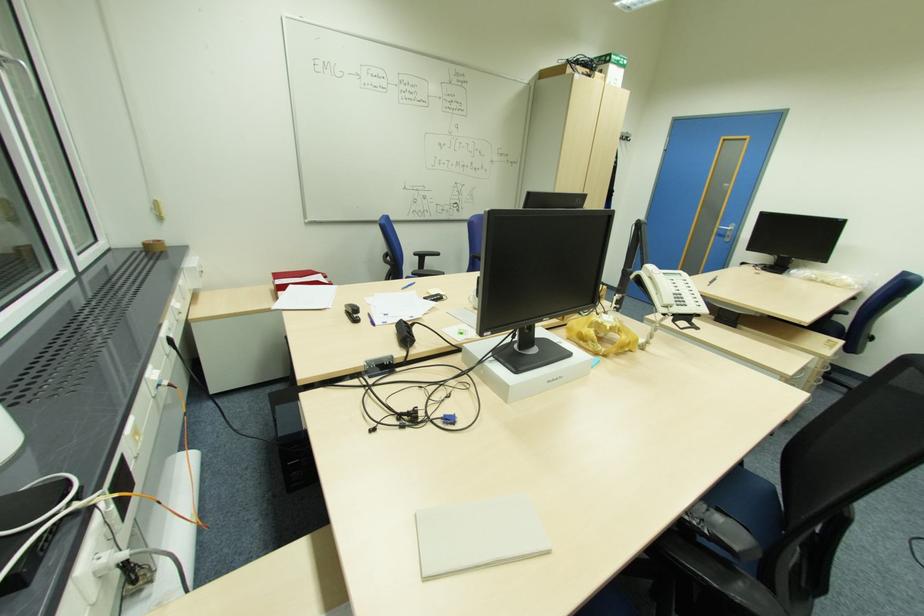
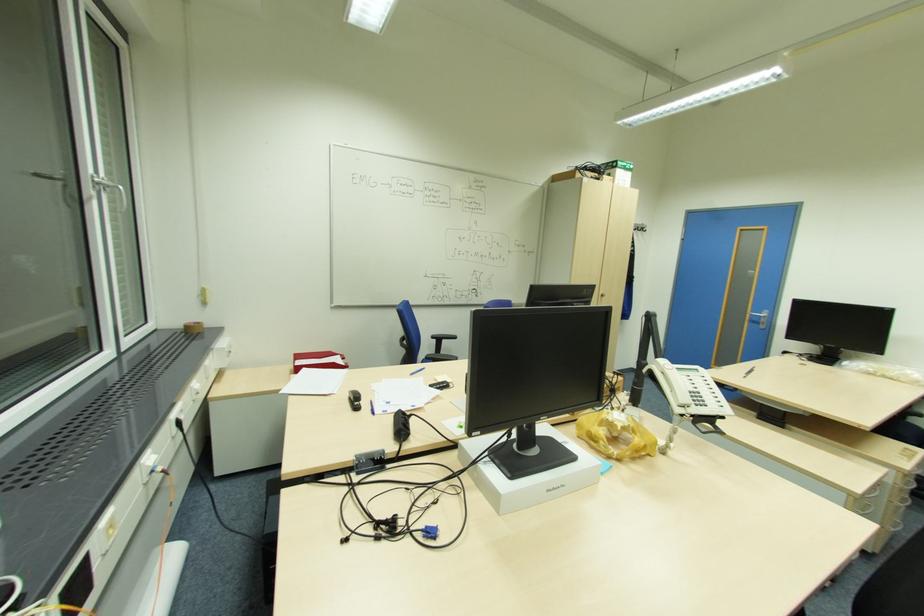
Where in the second image is the point corresponding to (608,355) from the first image?

(621, 459)